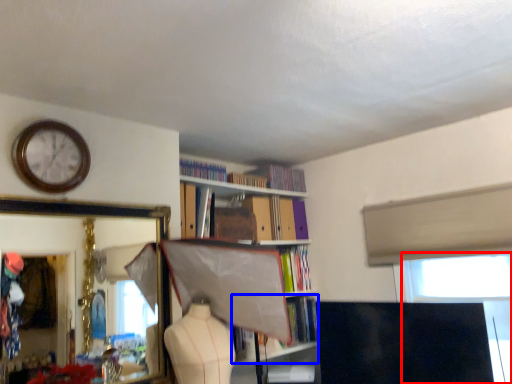
Question: Which object is closer to the camera taking this photo, window screen (highlighted by a red box) or book (highlighted by a blue box)?

Choices:
 (A) window screen
 (B) book

Answer: (A)